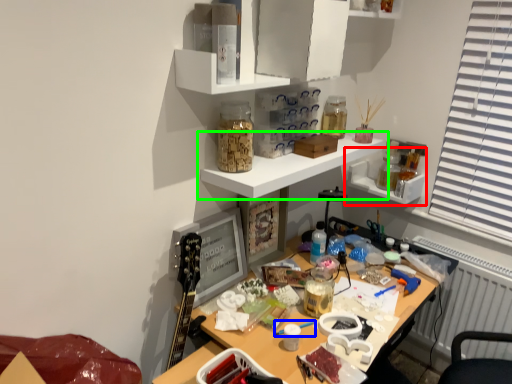
Question: Estimate the real-world distances between objects in this image. Which object is closer to shelf (highlighted by a red box), paint brush (highlighted by a blue box) or shelf (highlighted by a green box)?

Choices:
 (A) paint brush
 (B) shelf

Answer: (B)